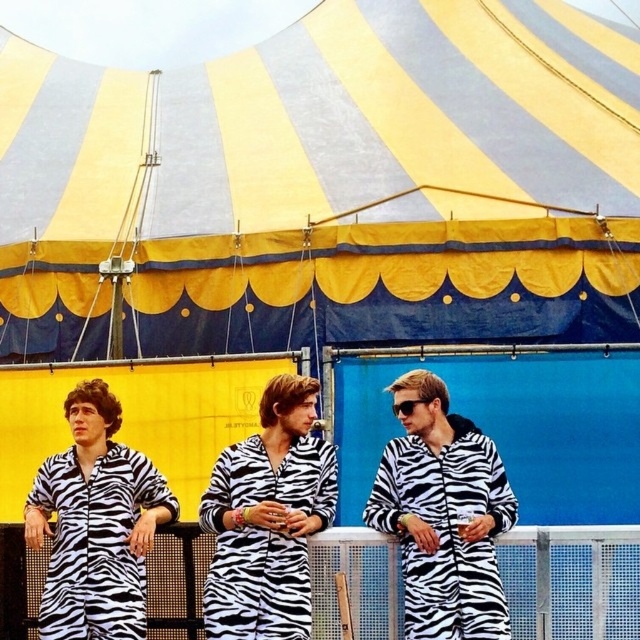
Can you confirm if zebra print onesie at center is positioned above zebra-patterned onesie at left?

Correct, zebra print onesie at center is located above zebra-patterned onesie at left.

What do you see at coordinates (262, 538) in the screenshot? I see `zebra print onesie at center` at bounding box center [262, 538].

The height and width of the screenshot is (640, 640). Find the location of `zebra print onesie at center`. zebra print onesie at center is located at coordinates (262, 538).

From the picture: Is zebra-patterned onesie at center taller than zebra print onesie at center?

Incorrect, zebra-patterned onesie at center's height is not larger of zebra print onesie at center's.

Is zebra-patterned onesie at center below zebra print onesie at center?

Incorrect, zebra-patterned onesie at center is not positioned below zebra print onesie at center.

The height and width of the screenshot is (640, 640). Describe the element at coordinates (442, 515) in the screenshot. I see `zebra-patterned onesie at center` at that location.

Find the location of a particular element. This screenshot has height=640, width=640. zebra-patterned onesie at center is located at coordinates (442, 515).

Can you confirm if yellow/blue striped tent at upper center is positioned to the right of zebra-patterned onesie at center?

Incorrect, yellow/blue striped tent at upper center is not on the right side of zebra-patterned onesie at center.

Locate an element on the screen. The image size is (640, 640). yellow/blue striped tent at upper center is located at coordinates (396, 182).

Who is more distant from viewer, (480, 307) or (435, 563)?

Point (480, 307)

Find the location of `yellow/blue striped tent at upper center`. yellow/blue striped tent at upper center is located at coordinates (396, 182).